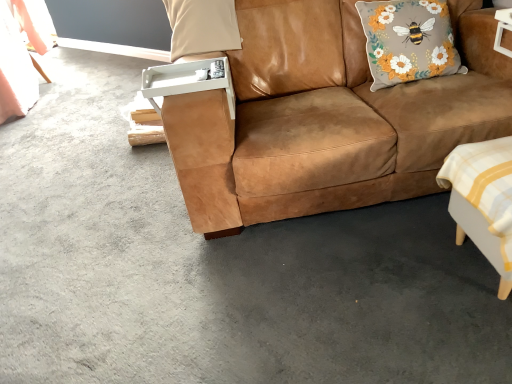
Question: Is floral fabric cushion with bee design at upper right, which ranks as the first pillow in right-to-left order, directly adjacent to white checkered fabric swivel chair at lower right?

Choices:
 (A) yes
 (B) no

Answer: (B)

Question: Can you confirm if floral fabric cushion with bee design at upper right, the 2th pillow positioned from the left, is smaller than white checkered fabric swivel chair at lower right?

Choices:
 (A) yes
 (B) no

Answer: (B)

Question: From the image's perspective, is floral fabric cushion with bee design at upper right, which ranks as the first pillow in right-to-left order, located above white checkered fabric swivel chair at lower right?

Choices:
 (A) no
 (B) yes

Answer: (B)

Question: Does floral fabric cushion with bee design at upper right, the 2th pillow positioned from the left, come in front of white checkered fabric swivel chair at lower right?

Choices:
 (A) no
 (B) yes

Answer: (A)

Question: Is floral fabric cushion with bee design at upper right, the 2th pillow positioned from the left, to the right of white checkered fabric swivel chair at lower right from the viewer's perspective?

Choices:
 (A) yes
 (B) no

Answer: (B)

Question: Looking at the image, does suede brown couch at center seem bigger or smaller compared to floral fabric cushion with bee design at upper right, the 2th pillow positioned from the left?

Choices:
 (A) big
 (B) small

Answer: (A)

Question: Is point (230, 192) positioned closer to the camera than point (359, 1)?

Choices:
 (A) farther
 (B) closer

Answer: (B)

Question: From a real-world perspective, relative to floral fabric cushion with bee design at upper right, which ranks as the first pillow in right-to-left order, is suede brown couch at center vertically above or below?

Choices:
 (A) below
 (B) above

Answer: (A)

Question: In terms of width, does suede brown couch at center look wider or thinner when compared to floral fabric cushion with bee design at upper right, which ranks as the first pillow in right-to-left order?

Choices:
 (A) thin
 (B) wide

Answer: (B)

Question: In terms of size, does white checkered fabric swivel chair at lower right appear bigger or smaller than suede brown couch at center?

Choices:
 (A) small
 (B) big

Answer: (A)

Question: Is white checkered fabric swivel chair at lower right wider or thinner than suede brown couch at center?

Choices:
 (A) wide
 (B) thin

Answer: (B)

Question: Is point (460, 152) positioned closer to the camera than point (333, 117)?

Choices:
 (A) closer
 (B) farther

Answer: (A)

Question: Visually, is white checkered fabric swivel chair at lower right positioned to the left or to the right of suede brown couch at center?

Choices:
 (A) left
 (B) right

Answer: (B)

Question: Would you say floral fabric cushion with bee design at upper right, the 2th pillow positioned from the left, is inside or outside white checkered fabric swivel chair at lower right?

Choices:
 (A) outside
 (B) inside

Answer: (A)

Question: From a real-world perspective, is floral fabric cushion with bee design at upper right, the 2th pillow positioned from the left, positioned above or below white checkered fabric swivel chair at lower right?

Choices:
 (A) below
 (B) above

Answer: (B)